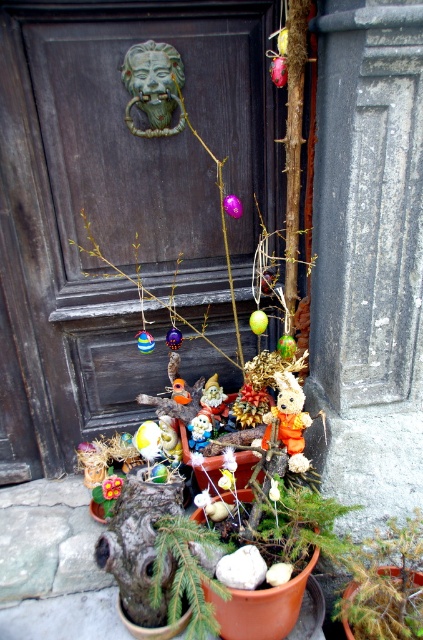
You are a delivery person trying to place a small package between the green matte plant at center and the orange fabric rabbit at center. Which object should you move to make space?

The green matte plant at center is bigger than the orange fabric rabbit at center, so you should move the orange fabric rabbit at center to make space for the package.

Looking at this image, you are a delivery person trying to determine if the green matte plant at center will block your view of the green matte lion head at upper center when you approach the door. Based on their sizes, can you see the lion head over the plant?

The green matte plant at center is larger than the green matte lion head at upper center, so it may block the view of the lion head when approaching the door.

You are standing in front of the dark wooden door and want to place a new decoration between the green matte plant at center and the green matte lion head at upper center. Is there enough space to place it vertically between them?

The green matte plant at center is positioned under the green matte lion head at upper center, so there is vertical space between them to place a new decoration.